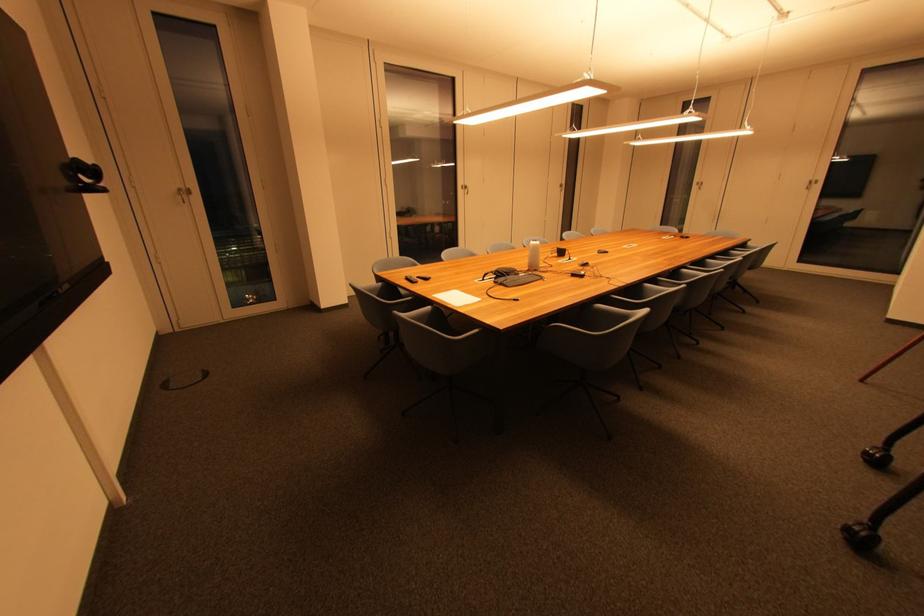
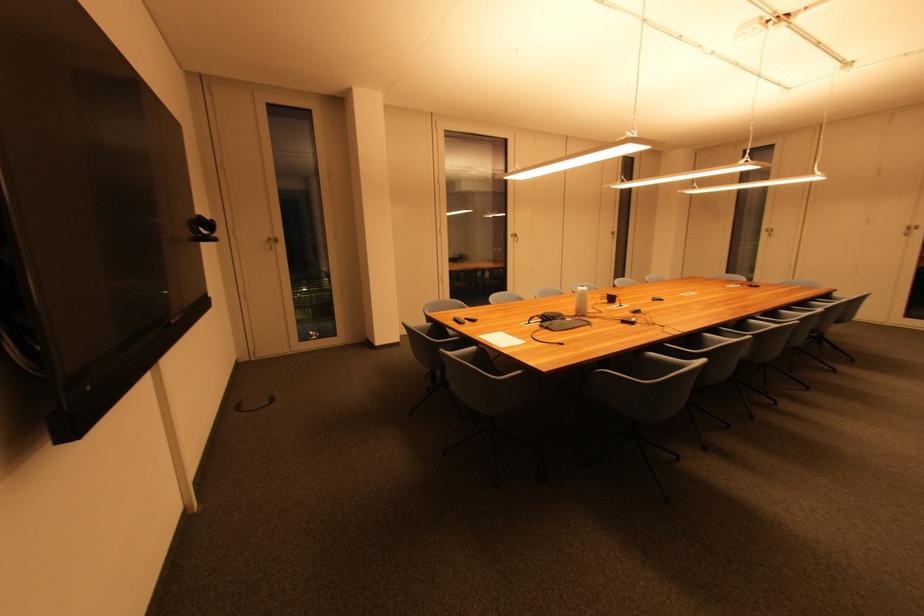
Question: The camera is either moving clockwise (left) or counter-clockwise (right) around the object. The first image is from the beginning of the video and the second image is from the end. Is the camera moving left or right when shooting the video?

Choices:
 (A) Left
 (B) Right

Answer: (B)